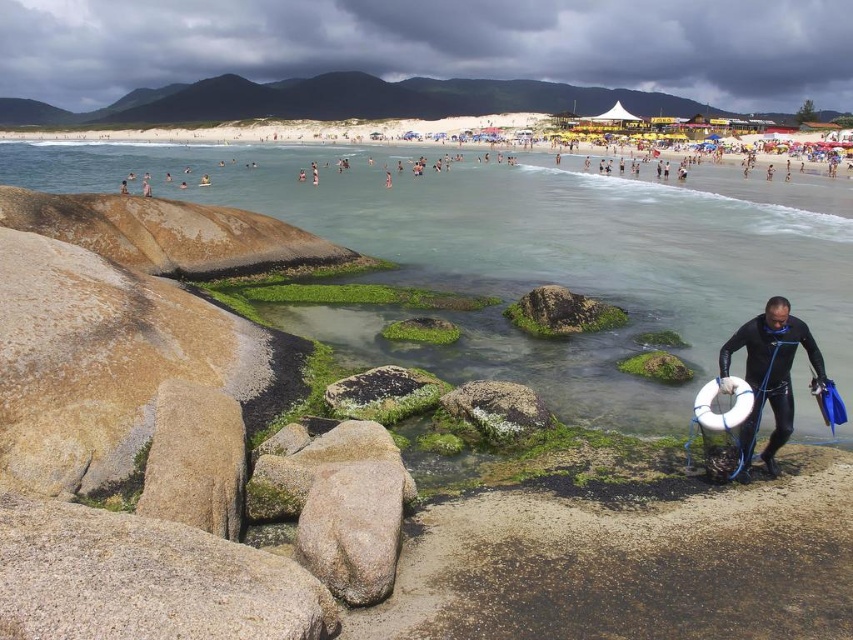
Between point (137, 600) and point (743, 449), which one is positioned in front?

Point (137, 600) is in front.

Who is positioned more to the left, gray granite rock at lower left or black wetsuit at lower right?

From the viewer's perspective, gray granite rock at lower left appears more on the left side.

This screenshot has height=640, width=853. What do you see at coordinates (144, 580) in the screenshot?
I see `gray granite rock at lower left` at bounding box center [144, 580].

Where is `gray granite rock at lower left`? gray granite rock at lower left is located at coordinates (144, 580).

Between gray rough rock at left and black wetsuit at lower right, which one has less height?

gray rough rock at left is shorter.

From the picture: Is gray rough rock at left wider than black wetsuit at lower right?

Incorrect, gray rough rock at left's width does not surpass black wetsuit at lower right's.

Who is more forward, [151,449] or [759,404]?

Positioned in front is point [151,449].

Locate an element on the screen. gray rough rock at left is located at coordinates (195, 460).

Which of these two, gray rough rock at left or gray rough rock at center, stands taller?

Standing taller between the two is gray rough rock at center.

Which is more to the left, gray rough rock at left or gray rough rock at center?

From the viewer's perspective, gray rough rock at left appears more on the left side.

Who is more distant from viewer, (210, 490) or (372, 508)?

Positioned behind is point (210, 490).

You are a GUI agent. You are given a task and a screenshot of the screen. Output one action in this format:
    pyautogui.click(x=<x>, y=<y>)
    Task: Click on the gray rough rock at left
    This screenshot has height=640, width=853.
    Given the screenshot: What is the action you would take?
    pyautogui.click(x=195, y=460)